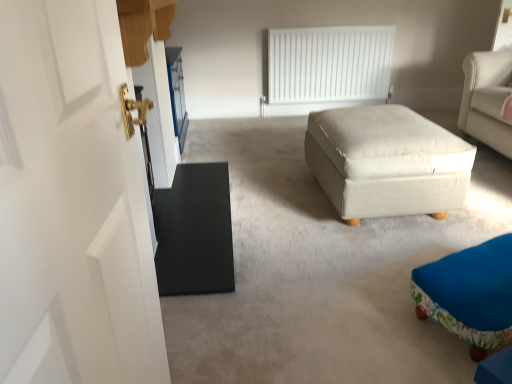
You are a GUI agent. You are given a task and a screenshot of the screen. Output one action in this format:
    pyautogui.click(x=<x>, y=<y>)
    Task: Click on the vacant point above black matte table at left, the 2th table when ordered from right to left (from a real-world perspective)
    
    Given the screenshot: What is the action you would take?
    pyautogui.click(x=189, y=225)